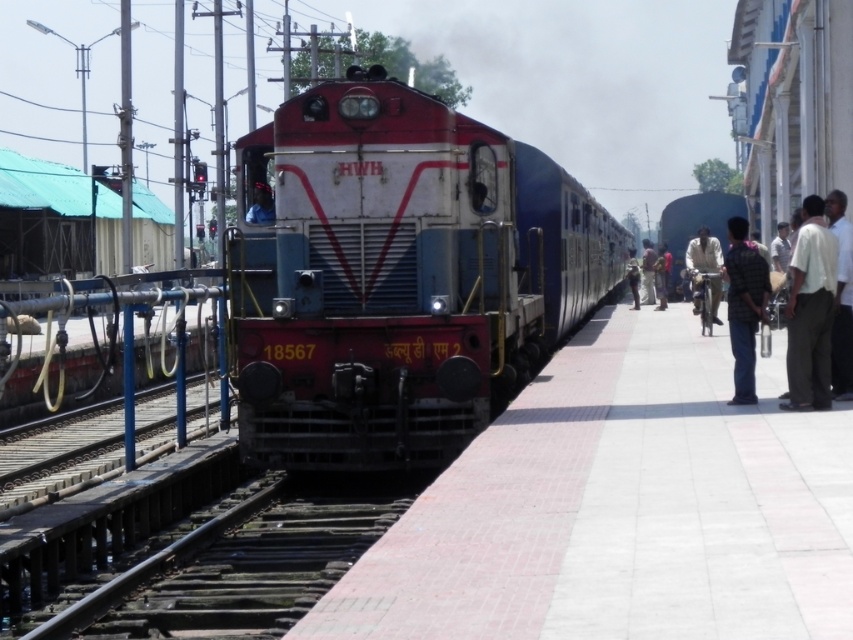
Does matte red locomotive at center have a greater height compared to dark blue shirt at right?

Indeed, matte red locomotive at center has a greater height compared to dark blue shirt at right.

The width and height of the screenshot is (853, 640). What do you see at coordinates (398, 275) in the screenshot?
I see `matte red locomotive at center` at bounding box center [398, 275].

The width and height of the screenshot is (853, 640). What do you see at coordinates (398, 275) in the screenshot?
I see `matte red locomotive at center` at bounding box center [398, 275].

Locate an element on the screen. Image resolution: width=853 pixels, height=640 pixels. matte red locomotive at center is located at coordinates (398, 275).

Is point (265, 208) positioned in front of point (631, 273)?

Yes, point (265, 208) is in front of point (631, 273).

Does blue fabric shirt at center appear under dark blue jeans at right?

Yes, blue fabric shirt at center is below dark blue jeans at right.

Which is in front, point (257, 198) or point (633, 308)?

Point (257, 198) is more forward.

I want to click on blue fabric shirt at center, so click(260, 205).

Which is more to the left, white cotton shirt at right or dark blue shirt at right?

white cotton shirt at right is more to the left.

Does point (817, 218) lie in front of point (650, 284)?

That is True.

At what (x,y) coordinates should I click in order to perform the action: click on white cotton shirt at right. Please return your answer as a coordinate pair (x, y). The width and height of the screenshot is (853, 640). Looking at the image, I should click on [810, 310].